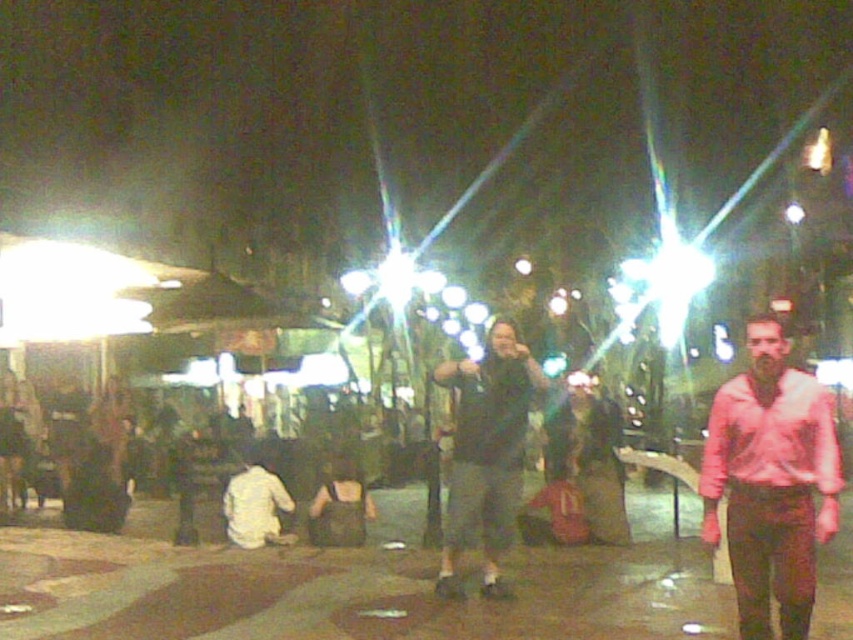
You are a photographer trying to capture a group photo of the pink cotton shirt at right and the dark gray fabric jacket at center in the nighttime scene. Considering the lens flare from the bright lights, which subject might be more challenging to frame clearly due to their position relative to the light source?

The pink cotton shirt at right might be wider than dark gray fabric jacket at center, so it could block more of the light source, causing more severe lens flare and making it harder to frame clearly.